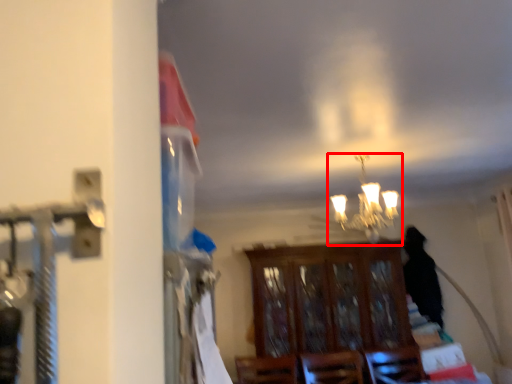
Question: Considering the relative positions of lamp (annotated by the red box) and furniture in the image provided, where is lamp (annotated by the red box) located with respect to the staircase?

Choices:
 (A) left
 (B) right

Answer: (A)